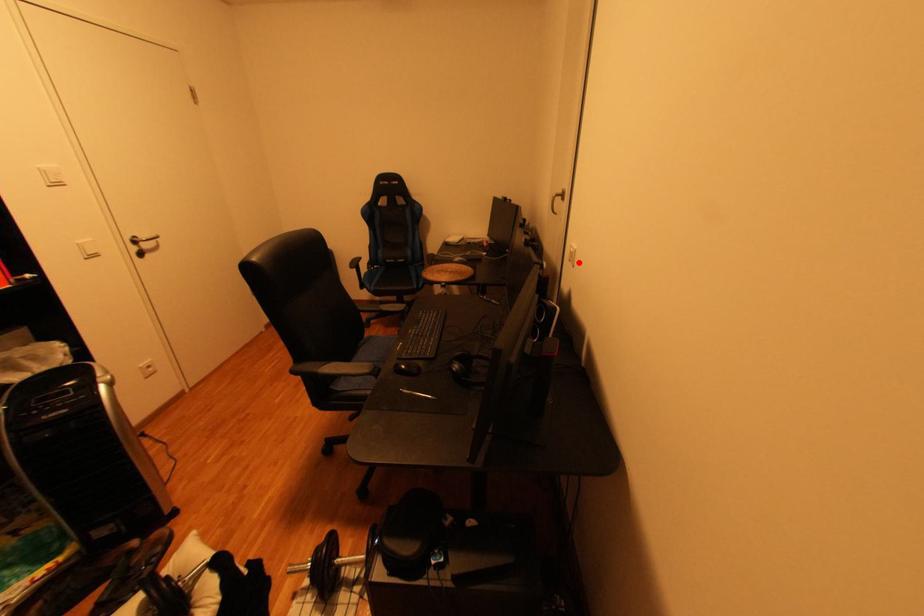
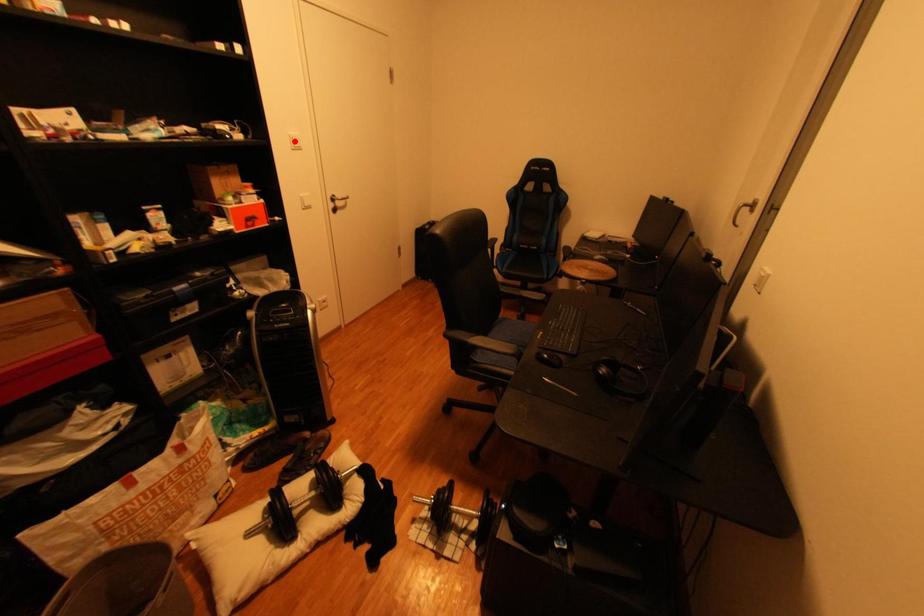
I am providing you with two images of the same scene from different viewpoints. A red point is marked on the first image and another point is marked on the second image. Are the points marked in image1 and image2 representing the same 3D position?

No